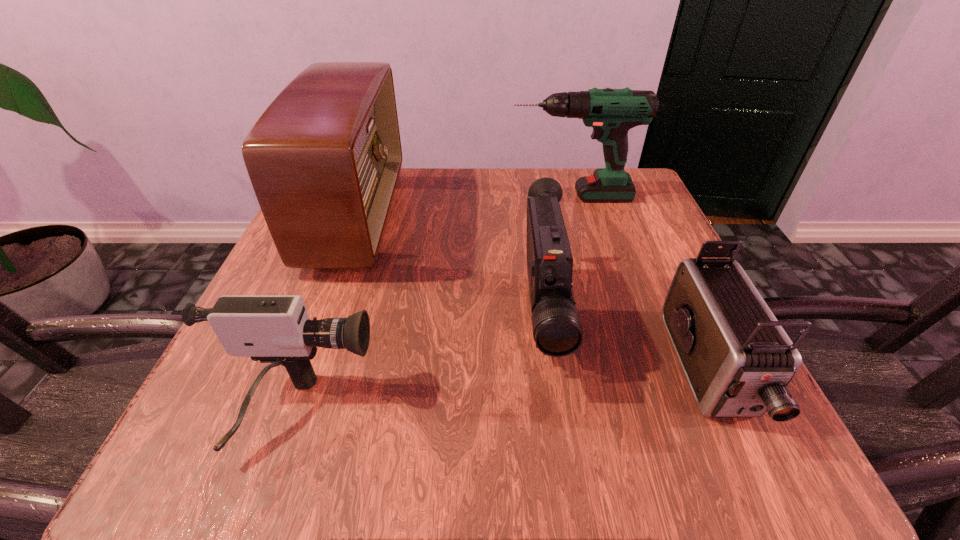
Locate an element on the screen. vacant space that's between the leftmost camcorder and the second camcorder from right to left is located at coordinates (420, 366).

The height and width of the screenshot is (540, 960). I want to click on free spot between the drill and the rightmost camcorder, so click(x=639, y=284).

This screenshot has height=540, width=960. I want to click on empty space between the second camcorder from right to left and the leftmost camcorder, so click(x=420, y=366).

Point out which object is positioned as the second nearest to the drill. Please provide its 2D coordinates. Your answer should be formatted as a tuple, i.e. [(x, y)], where the tuple contains the x and y coordinates of a point satisfying the conditions above.

[(324, 159)]

Choose which object is the second nearest neighbor to the leftmost camcorder. Please provide its 2D coordinates. Your answer should be formatted as a tuple, i.e. [(x, y)], where the tuple contains the x and y coordinates of a point satisfying the conditions above.

[(557, 331)]

The height and width of the screenshot is (540, 960). Find the location of `camcorder identified as the second closest to the rightmost camcorder`. camcorder identified as the second closest to the rightmost camcorder is located at coordinates (276, 329).

Locate which camcorder is the second closest to the second camcorder from right to left. Please provide its 2D coordinates. Your answer should be formatted as a tuple, i.e. [(x, y)], where the tuple contains the x and y coordinates of a point satisfying the conditions above.

[(276, 329)]

The image size is (960, 540). Find the location of `free point that satisfies the following two spatial constraints: 1. on the handle side of the drill; 2. on the front-facing side of the second camcorder from left to right`. free point that satisfies the following two spatial constraints: 1. on the handle side of the drill; 2. on the front-facing side of the second camcorder from left to right is located at coordinates (606, 318).

This screenshot has height=540, width=960. In order to click on blank space that satisfies the following two spatial constraints: 1. at the lens of the rightmost camcorder; 2. on the recording direction of the leftmost camcorder in this screenshot , I will do (727, 413).

At what (x,y) coordinates should I click in order to perform the action: click on vacant area in the image that satisfies the following two spatial constraints: 1. on the front-facing side of the second camcorder from right to left; 2. on the recording direction of the leftmost camcorder. Please return your answer as a coordinate pair (x, y). Looking at the image, I should click on (555, 413).